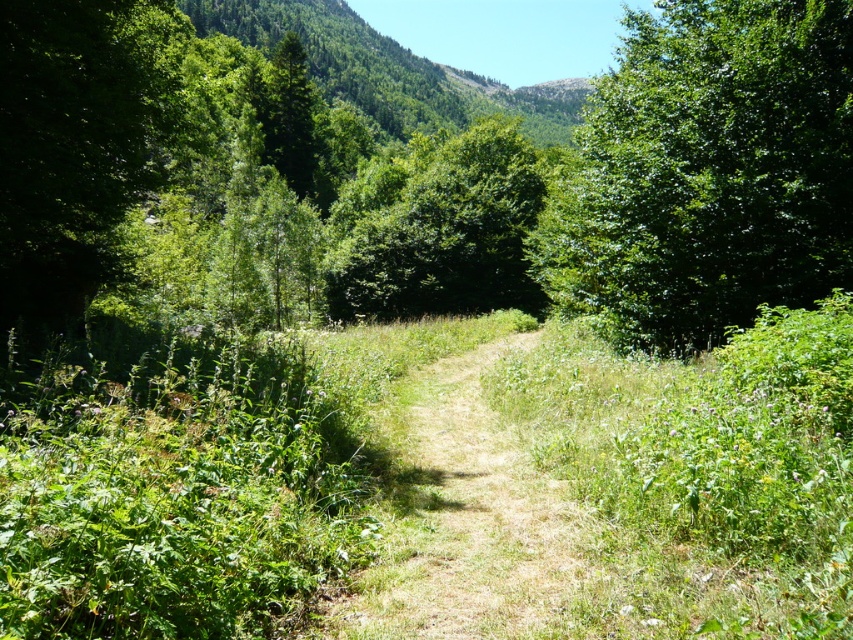
Question: Considering the relative positions of green grassy trail at center and green leafy tree at center in the image provided, where is green grassy trail at center located with respect to green leafy tree at center?

Choices:
 (A) below
 (B) above

Answer: (A)

Question: Can you confirm if green grassy trail at center is bigger than green leafy tree at center?

Choices:
 (A) yes
 (B) no

Answer: (B)

Question: Which of the following is the closest to the observer?

Choices:
 (A) green leafy tree at center
 (B) green matte tree at upper center

Answer: (A)

Question: Among these objects, which one is farthest from the camera?

Choices:
 (A) green matte tree at upper center
 (B) green grassy trail at center
 (C) green leafy tree at upper right
 (D) green leafy tree at center

Answer: (A)

Question: Can you confirm if green grassy trail at center is positioned to the left of green leafy tree at center?

Choices:
 (A) no
 (B) yes

Answer: (A)

Question: Which point appears closest to the camera in this image?

Choices:
 (A) (693, 253)
 (B) (589, 588)

Answer: (B)